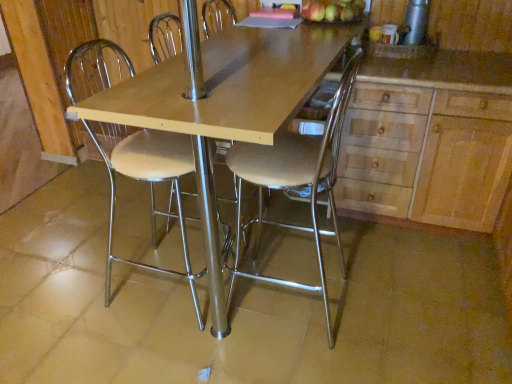
Find the location of a particular element. Image resolution: width=512 pixels, height=384 pixels. free spot in front of metallic silver stool at center, the first chair in the left-to-right sequence is located at coordinates (159, 351).